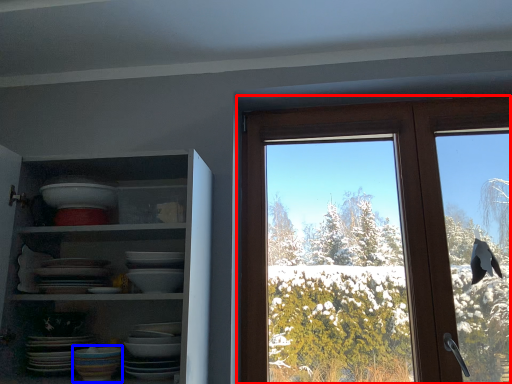
Question: Which of the following is the farthest to the observer, window (highlighted by a red box) or tableware (highlighted by a blue box)?

Choices:
 (A) window
 (B) tableware

Answer: (A)